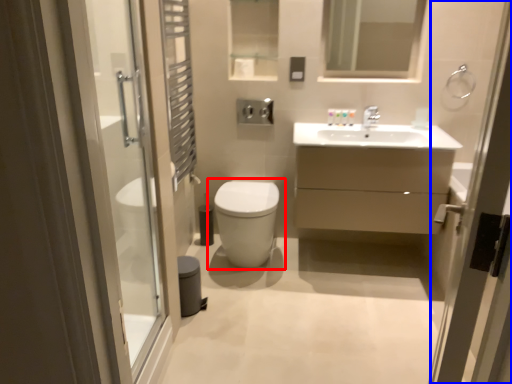
Question: Which of the following is the closest to the observer, toilet (highlighted by a red box) or screen door (highlighted by a blue box)?

Choices:
 (A) toilet
 (B) screen door

Answer: (B)